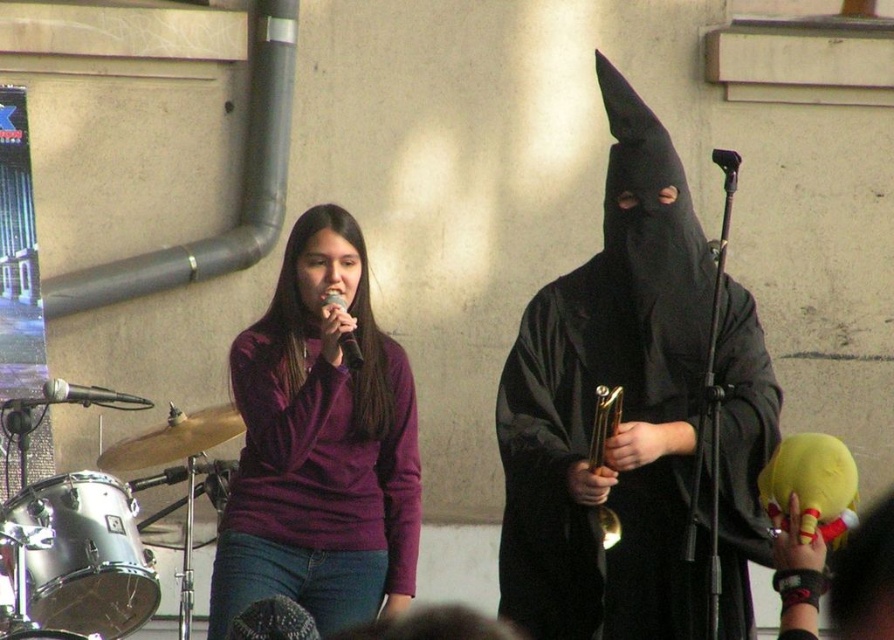
Between gold shiny trumpet at center and metallic silver microphone at left, which one is positioned higher?

metallic silver microphone at left

How distant is gold shiny trumpet at center from metallic silver microphone at left?

gold shiny trumpet at center and metallic silver microphone at left are 7.44 feet apart.

Is point (596, 524) positioned in front of point (131, 404)?

Yes.

The width and height of the screenshot is (894, 640). I want to click on gold shiny trumpet at center, so click(x=603, y=422).

Is the position of black matte cloak at center less distant than that of purple velvet shirt at center?

Yes, black matte cloak at center is closer to the viewer.

Is point (654, 116) closer to viewer compared to point (403, 406)?

That is True.

Is point (559, 285) closer to camera compared to point (330, 598)?

No.

Locate an element on the screen. black matte cloak at center is located at coordinates [x=622, y=408].

Which is in front, point (502, 588) or point (334, 296)?

Point (334, 296) is more forward.

The height and width of the screenshot is (640, 894). Describe the element at coordinates (622, 408) in the screenshot. I see `black matte cloak at center` at that location.

Where is `black matte cloak at center`? The image size is (894, 640). black matte cloak at center is located at coordinates (622, 408).